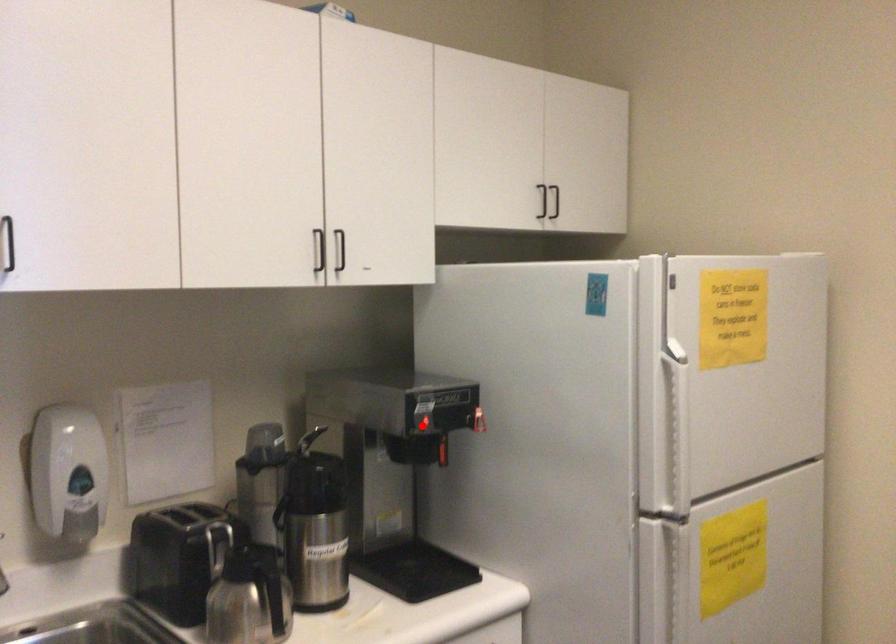
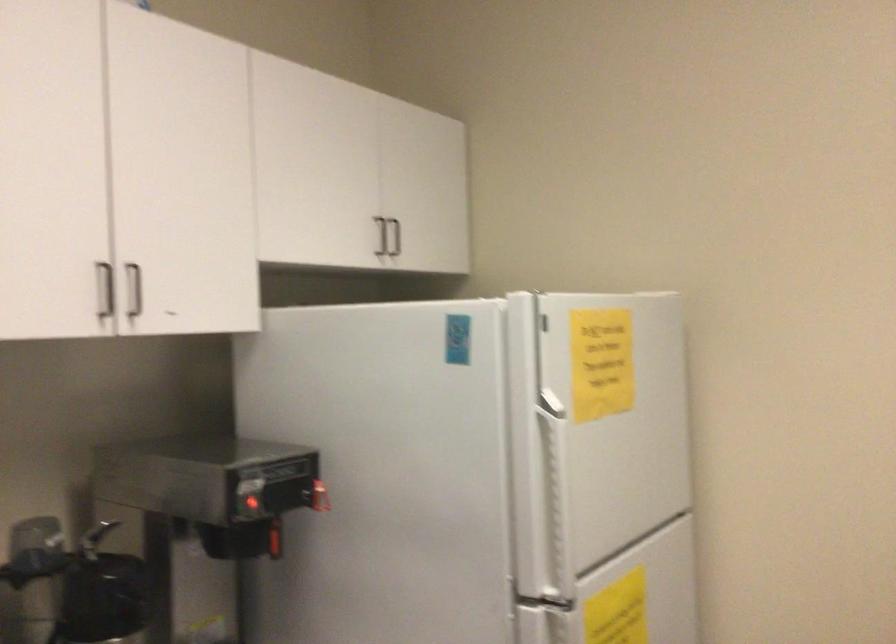
Question: I am providing you with two images of the same scene from different viewpoints. Image1 has a red point marked. In image2, the corresponding 3D location appears at what relative position? Reply with the corresponding letter.

Choices:
 (A) Closer
 (B) Farther

Answer: (A)